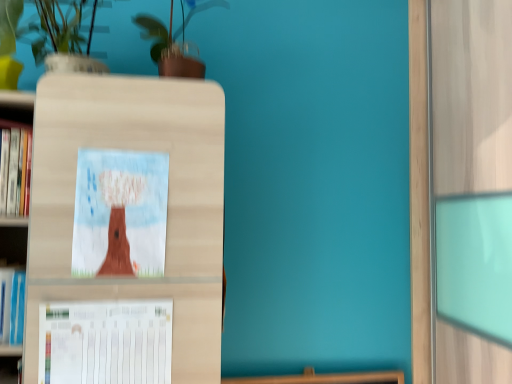
Question: Does matte cardboard picture frame at center have a smaller size compared to white matte vase at upper left?

Choices:
 (A) no
 (B) yes

Answer: (B)

Question: Is matte cardboard picture frame at center bigger than white matte vase at upper left?

Choices:
 (A) no
 (B) yes

Answer: (A)

Question: Considering the relative positions of matte cardboard picture frame at center and white matte vase at upper left in the image provided, is matte cardboard picture frame at center to the left of white matte vase at upper left from the viewer's perspective?

Choices:
 (A) yes
 (B) no

Answer: (B)

Question: Is matte cardboard picture frame at center facing towards white matte vase at upper left?

Choices:
 (A) yes
 (B) no

Answer: (B)

Question: Is matte cardboard picture frame at center in front of white matte vase at upper left?

Choices:
 (A) yes
 (B) no

Answer: (B)

Question: Relative to white matte vase at upper left, is white paper at lower left in front or behind?

Choices:
 (A) front
 (B) behind

Answer: (B)

Question: Considering the positions of white paper at lower left and white matte vase at upper left in the image, is white paper at lower left wider or thinner than white matte vase at upper left?

Choices:
 (A) thin
 (B) wide

Answer: (A)

Question: Is white paper at lower left bigger or smaller than white matte vase at upper left?

Choices:
 (A) big
 (B) small

Answer: (B)

Question: Do you think white paper at lower left is within white matte vase at upper left, or outside of it?

Choices:
 (A) outside
 (B) inside

Answer: (A)

Question: Is white matte vase at upper left wider or thinner than green glossy plant at upper center?

Choices:
 (A) wide
 (B) thin

Answer: (A)

Question: From the image's perspective, is white matte vase at upper left located above or below green glossy plant at upper center?

Choices:
 (A) below
 (B) above

Answer: (A)

Question: Would you say white matte vase at upper left is inside or outside green glossy plant at upper center?

Choices:
 (A) outside
 (B) inside

Answer: (A)

Question: Is point (1, 51) positioned closer to the camera than point (138, 26)?

Choices:
 (A) closer
 (B) farther

Answer: (A)

Question: Would you say white paper at lower left is to the left or to the right of green glossy plant at upper center in the picture?

Choices:
 (A) left
 (B) right

Answer: (A)

Question: Is white paper at lower left wider or thinner than green glossy plant at upper center?

Choices:
 (A) wide
 (B) thin

Answer: (B)